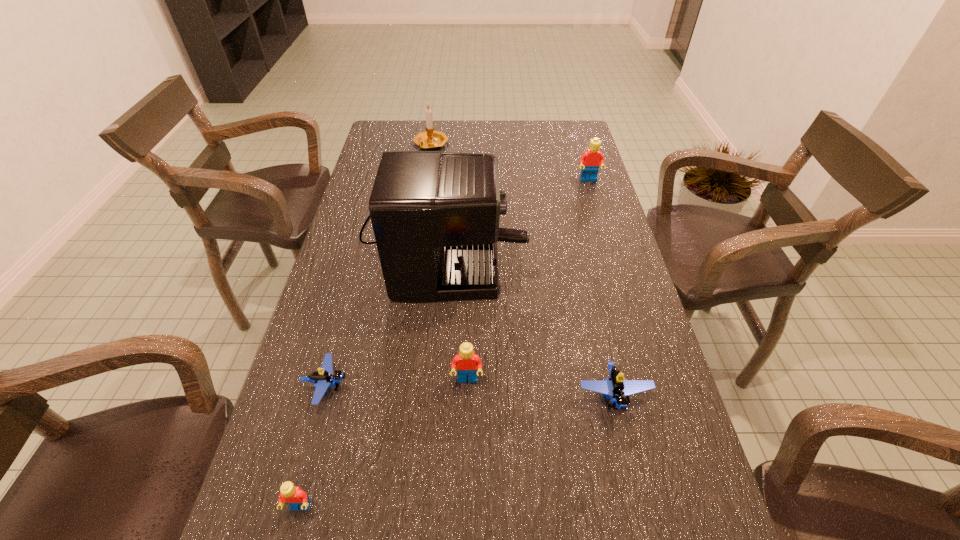
Find the location of a particular element. the nearest object is located at coordinates (295, 497).

Where is `the shortest Lego`? The height and width of the screenshot is (540, 960). the shortest Lego is located at coordinates (324, 378).

The image size is (960, 540). Identify the location of the smaller blue Lego. (324, 378).

The image size is (960, 540). Find the location of `free region located 0.180m on the front-facing side of the black coffee maker`. free region located 0.180m on the front-facing side of the black coffee maker is located at coordinates (583, 233).

What are the coordinates of `free spot located on the front of the candle holder` in the screenshot? It's located at (428, 163).

The width and height of the screenshot is (960, 540). Find the location of `free spot located 0.400m on the face of the biggest red Lego`. free spot located 0.400m on the face of the biggest red Lego is located at coordinates (615, 269).

This screenshot has height=540, width=960. In order to click on free space located on the face of the fourth tallest object in this screenshot , I will do `click(465, 492)`.

You are a GUI agent. You are given a task and a screenshot of the screen. Output one action in this format:
    pyautogui.click(x=<x>, y=<y>)
    Task: Click on the vacant space located on the front-facing side of the right blue Lego
    
    Given the screenshot: What is the action you would take?
    pyautogui.click(x=646, y=536)

Identify the location of vacant space situated on the front-facing side of the shortest object. The width and height of the screenshot is (960, 540). (448, 386).

Locate an element on the screen. Image resolution: width=960 pixels, height=540 pixels. object at the far edge is located at coordinates (430, 139).